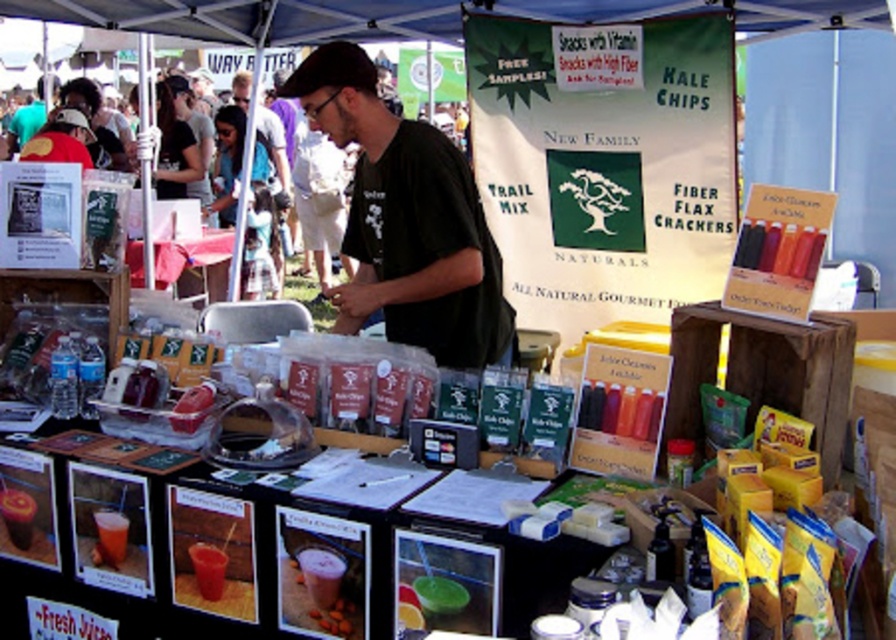
Question: Is black matte shirt at center positioned before matte plastic table at center?

Choices:
 (A) no
 (B) yes

Answer: (B)

Question: Does black matte shirt at center have a lesser width compared to matte plastic table at center?

Choices:
 (A) no
 (B) yes

Answer: (A)

Question: Is black matte shirt at center positioned behind matte plastic table at center?

Choices:
 (A) no
 (B) yes

Answer: (A)

Question: Which point is closer to the camera?

Choices:
 (A) matte plastic table at center
 (B) black matte shirt at center

Answer: (B)